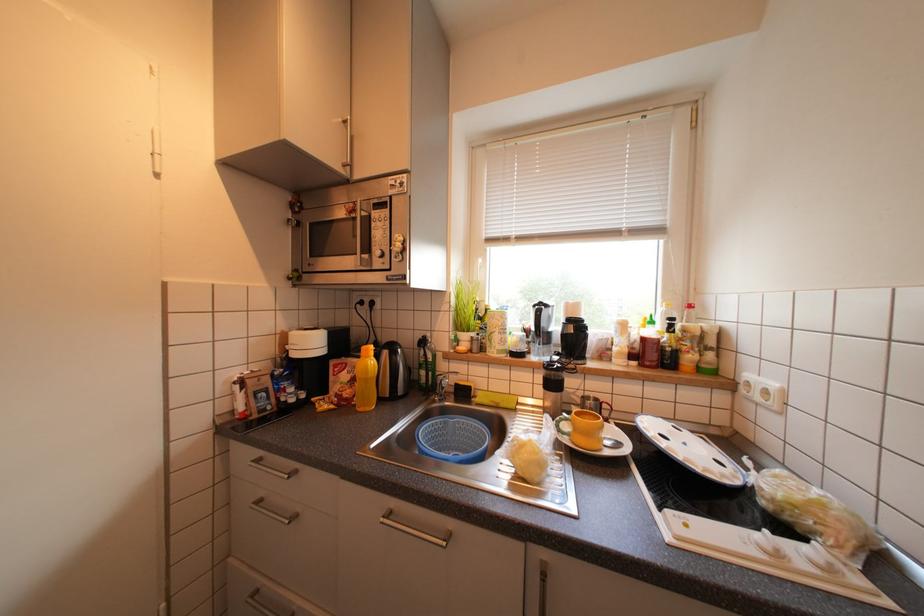
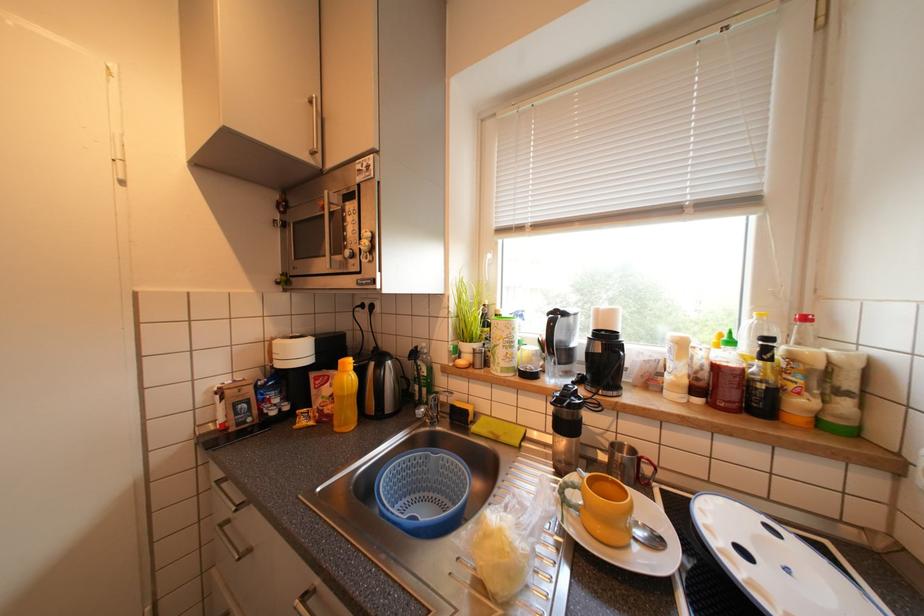
Question: The camera is either moving clockwise (left) or counter-clockwise (right) around the object. The first image is from the beginning of the video and the second image is from the end. Is the camera moving left or right when shooting the video?

Choices:
 (A) Left
 (B) Right

Answer: (B)